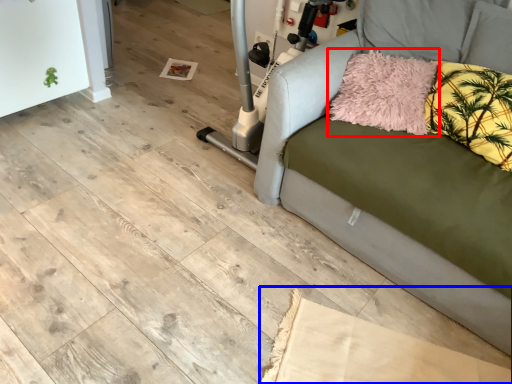
Question: Which object is further to the camera taking this photo, pillow (highlighted by a red box) or cardboard (highlighted by a blue box)?

Choices:
 (A) pillow
 (B) cardboard

Answer: (A)